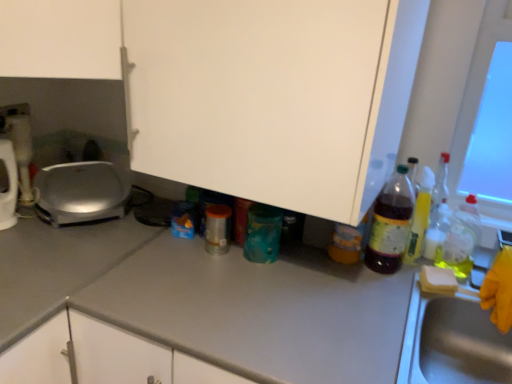
This screenshot has height=384, width=512. Identify the location of free space in front of metallic silver toaster at left, the second appliance viewed from the left. (24, 221).